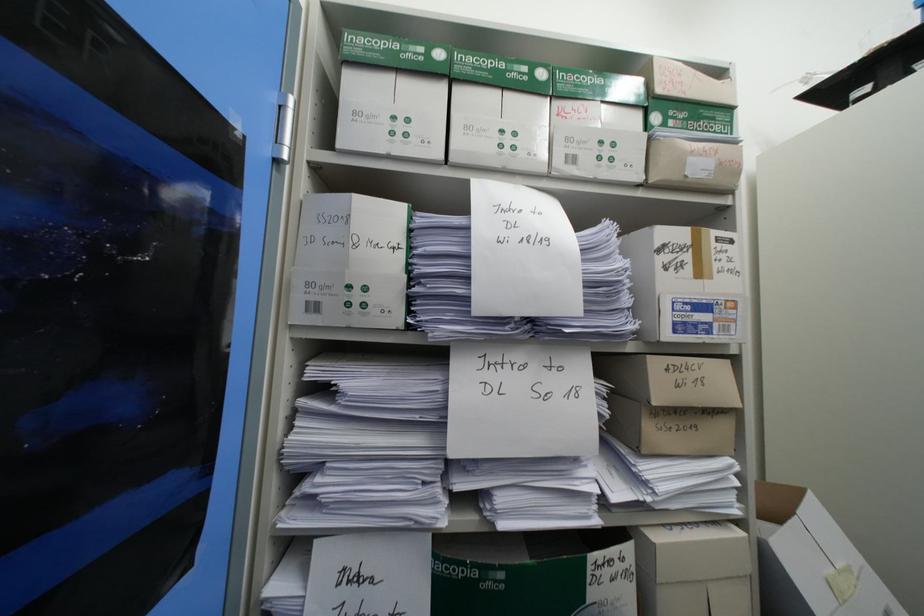
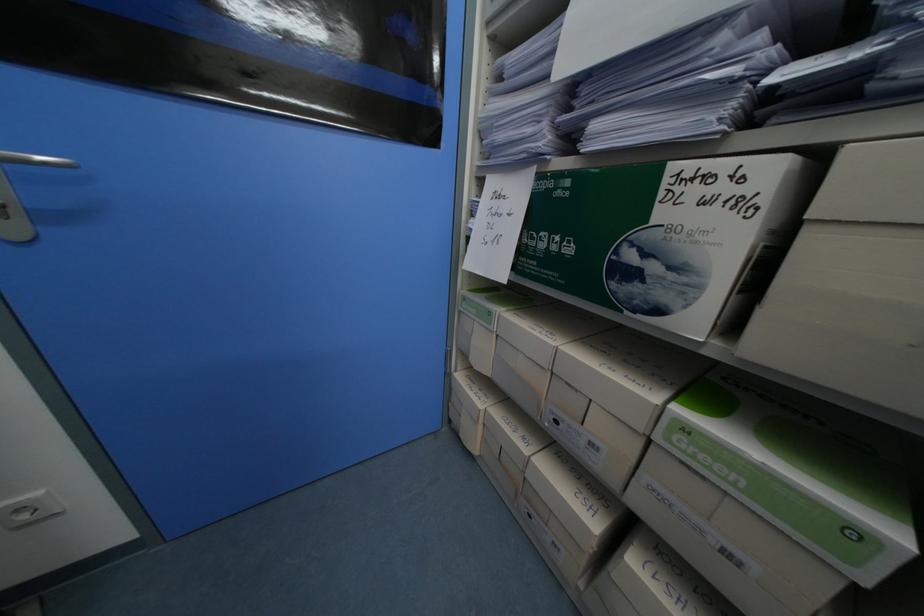
Based on the continuous images, in which direction is the camera rotating?

The rotation direction of the camera is left-down.